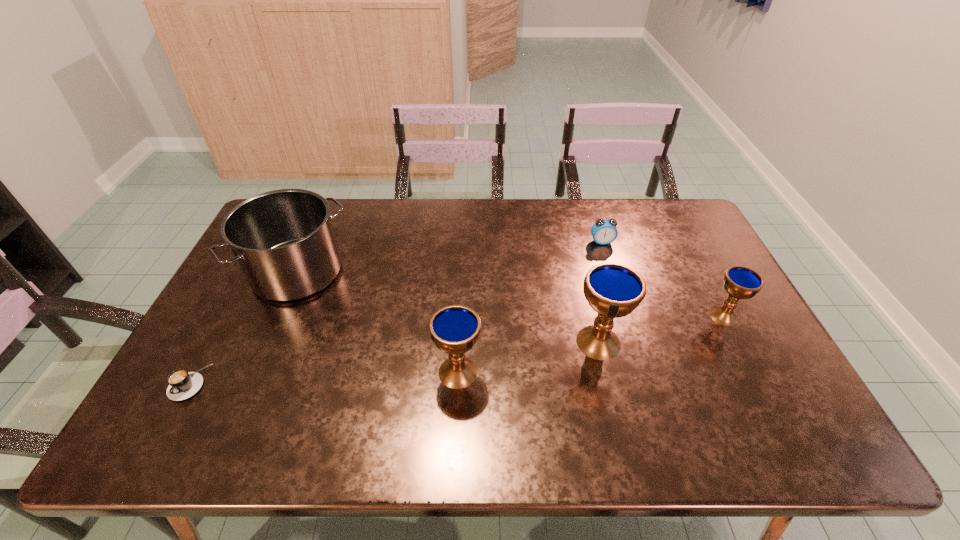
Locate an element on the screen. Image resolution: width=960 pixels, height=540 pixels. the leftmost chalice is located at coordinates (454, 329).

The width and height of the screenshot is (960, 540). Find the location of `the third object from left to right`. the third object from left to right is located at coordinates 454,329.

The width and height of the screenshot is (960, 540). Identify the location of the second chalice from left to right. (613, 290).

In order to click on the third shortest object in this screenshot , I will do `click(740, 282)`.

You are a GUI agent. You are given a task and a screenshot of the screen. Output one action in this format:
    pyautogui.click(x=<x>, y=<y>)
    Task: Click on the rightmost chalice
    
    Given the screenshot: What is the action you would take?
    pyautogui.click(x=740, y=282)

What are the coordinates of `saucepan` in the screenshot? It's located at (283, 240).

Locate an element on the screen. alarm clock is located at coordinates (604, 231).

Locate an element on the screen. cappuccino is located at coordinates (182, 384).

The height and width of the screenshot is (540, 960). Identify the location of vacant region located on the right of the leftmost chalice. (533, 372).

Find the location of a particular element. The height and width of the screenshot is (540, 960). vacant space located 0.210m on the back of the second chalice from left to right is located at coordinates (581, 270).